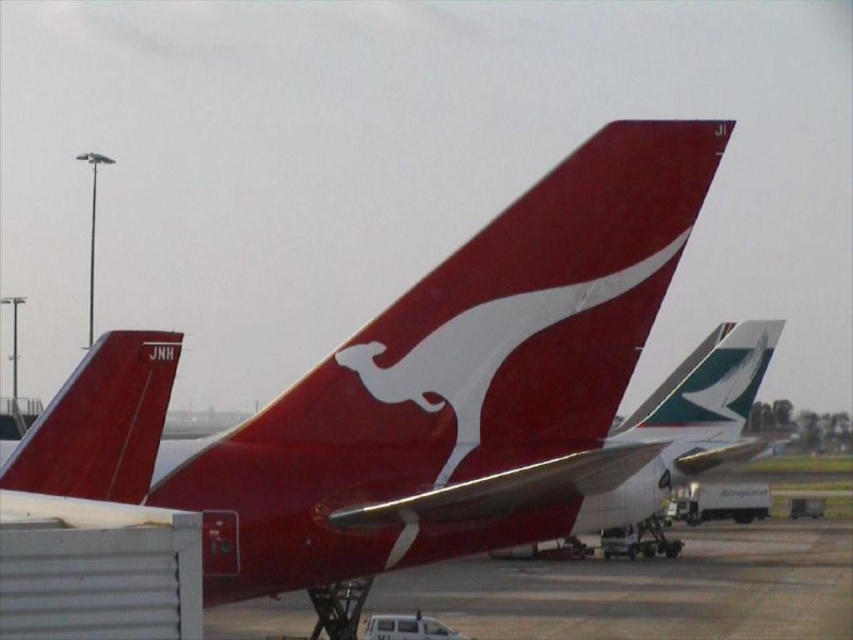
You are a ground crew member at the airport. You need to move a luggage cart from the matte red tail fin at left to the matte red airplane at center. Based on the scene, which direction should you push the cart to reach the airplane?

The matte red airplane at center is to the right of the matte red tail fin at left, so you should push the cart to the right to reach the airplane.

You are standing at the point marked as point (416, 392) on the airport tarmac. Based on the scene, which aircraft tail is directly beneath you? Please choose from the objects listed.

The point (416, 392) is on the matte red airplane at center, which has the Qantas kangaroo logo and registration code JH. Therefore, the aircraft tail directly beneath you is the matte red airplane at center with Qantas kangaroo logo and registration code JH.